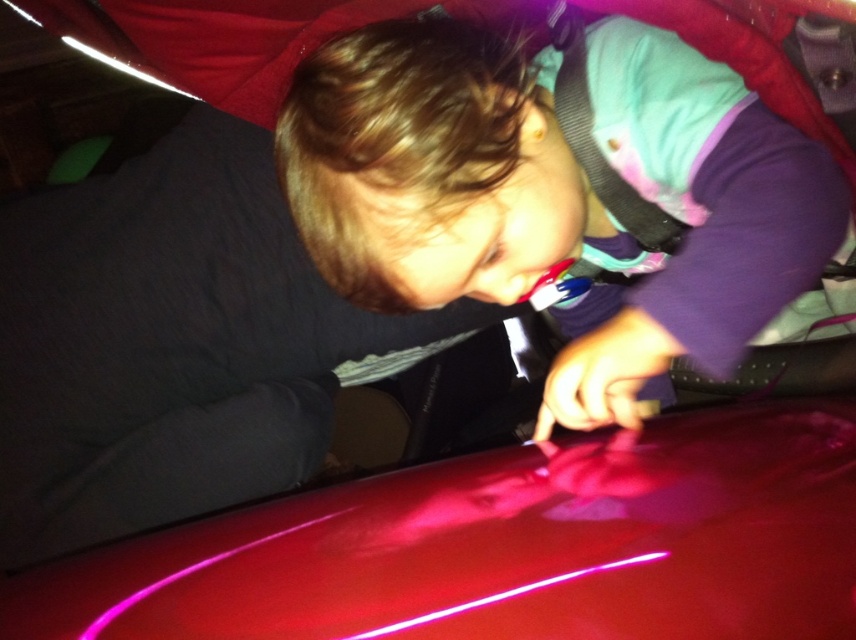
Who is more forward, [452,211] or [90,636]?

Point [90,636] is in front.

Between point (597, 216) and point (509, 456), which one is positioned behind?

Positioned behind is point (597, 216).

Which is in front, point (369, 264) or point (645, 596)?

Point (645, 596)

Where is `matte purple shirt at center`? The height and width of the screenshot is (640, 856). matte purple shirt at center is located at coordinates (557, 195).